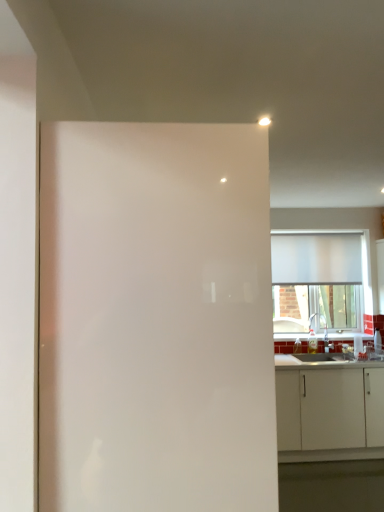
Question: In terms of width, does white glossy screen door at center look wider or thinner when compared to white matte window at upper right?

Choices:
 (A) wide
 (B) thin

Answer: (A)

Question: Visually, is white glossy screen door at center positioned to the left or to the right of white matte window at upper right?

Choices:
 (A) left
 (B) right

Answer: (A)

Question: Considering the real-world distances, which object is farthest from the white matte cabinet at lower right?

Choices:
 (A) white matte window at upper right
 (B) white glossy screen door at center
 (C) white glossy countertop at lower right

Answer: (B)

Question: Which object is the closest to the white glossy screen door at center?

Choices:
 (A) white matte window at upper right
 (B) white glossy countertop at lower right
 (C) white matte cabinet at lower right

Answer: (B)